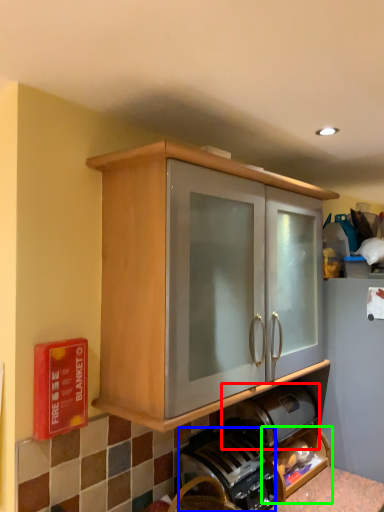
Question: Which object is positioned closest to appliance (highlighted by a red box)? Select from coffee machine (highlighted by a blue box) and shelf (highlighted by a green box).

Choices:
 (A) coffee machine
 (B) shelf

Answer: (B)